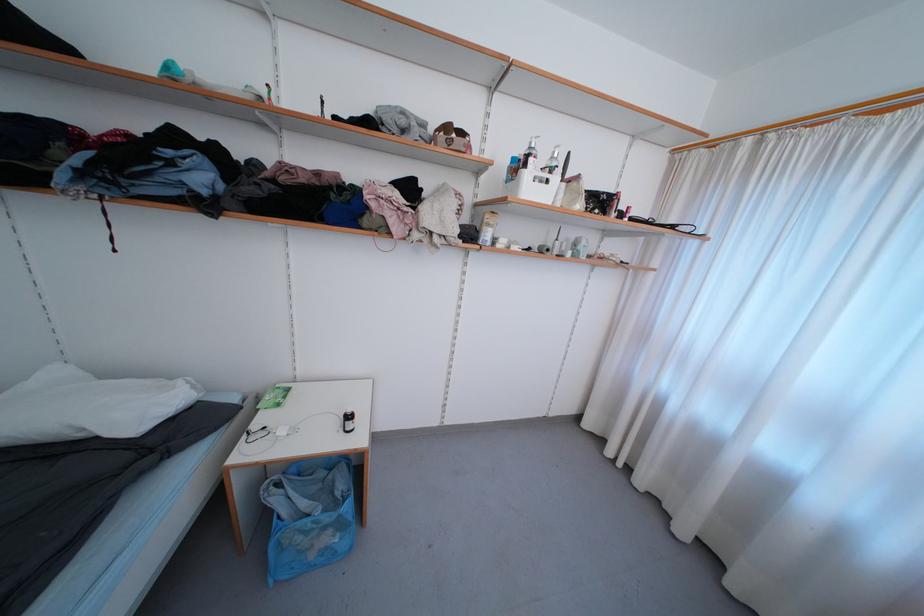
What do you see at coordinates (529, 155) in the screenshot? The height and width of the screenshot is (616, 924). I see `the white can actuator` at bounding box center [529, 155].